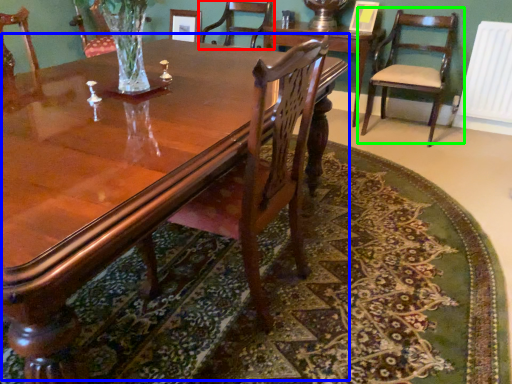
Question: Which object is the farthest from chair (highlighted by a red box)? Choose among these: coffee table (highlighted by a blue box) or chair (highlighted by a green box).

Choices:
 (A) coffee table
 (B) chair

Answer: (A)